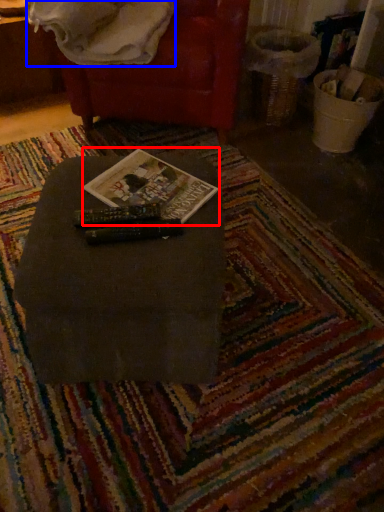
Question: Which object is closer to the camera taking this photo, paperback book (highlighted by a red box) or blanket (highlighted by a blue box)?

Choices:
 (A) paperback book
 (B) blanket

Answer: (A)